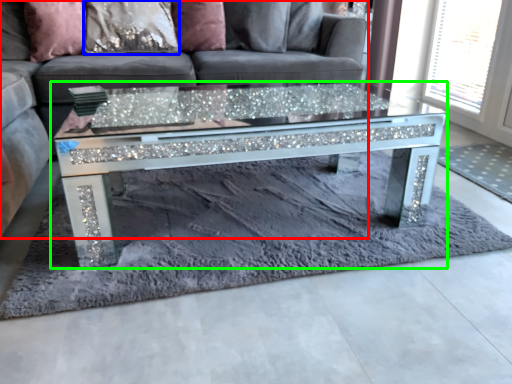
Question: Based on their relative distances, which object is farther from studio couch (highlighted by a red box)? Choose from pillow (highlighted by a blue box) and coffee table (highlighted by a green box).

Choices:
 (A) pillow
 (B) coffee table

Answer: (B)